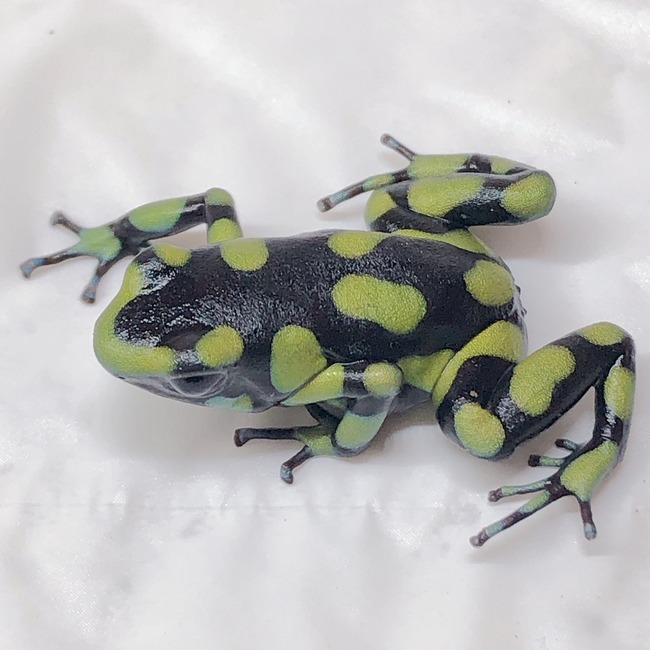
Identify the location of white cloth surface. The height and width of the screenshot is (650, 650). (326, 586).